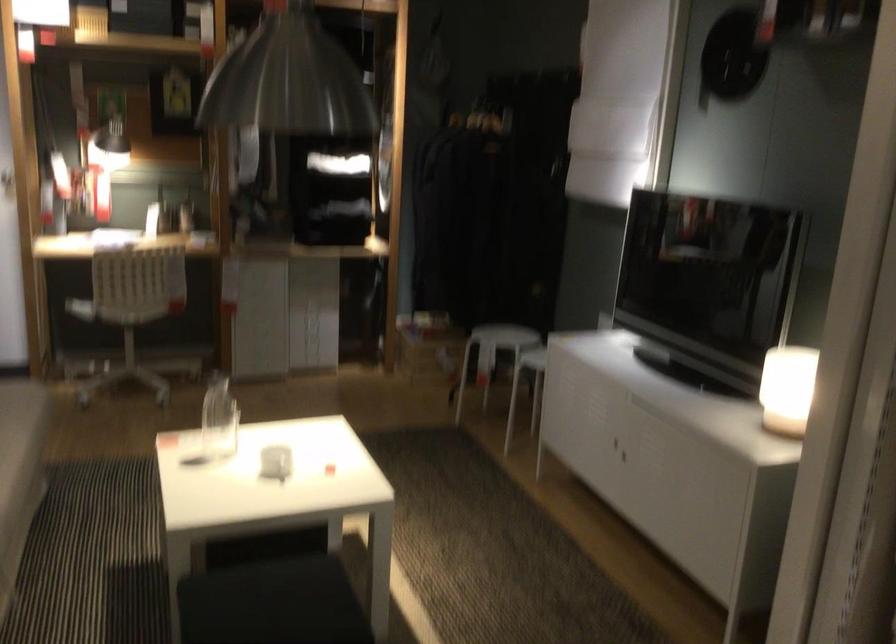
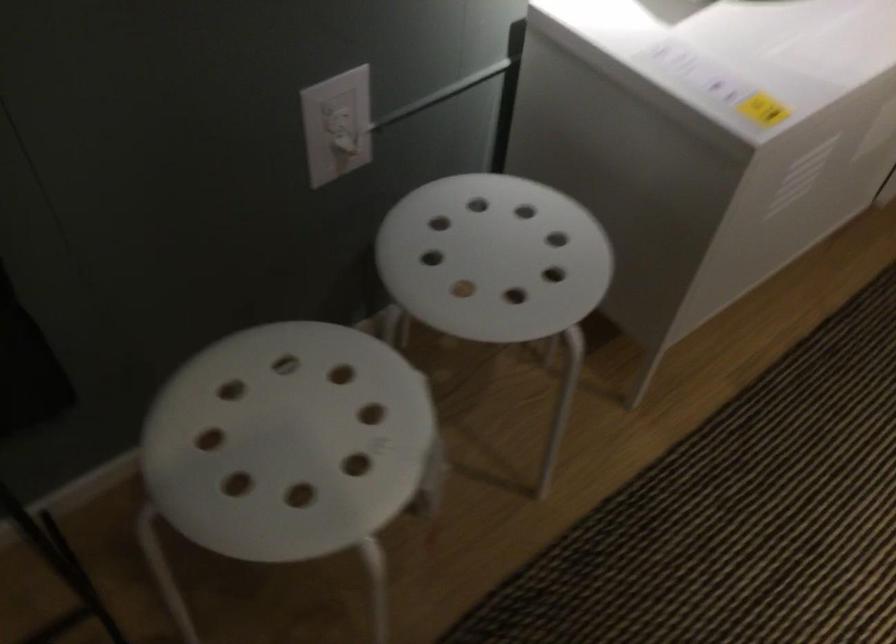
Find the pixel in the second image that matches point 504,330 in the first image.

(288, 442)